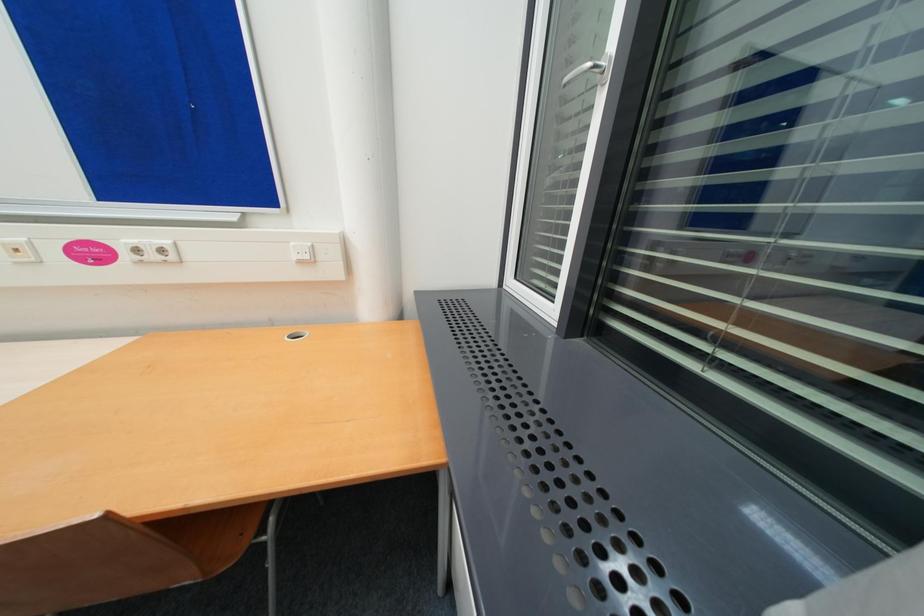
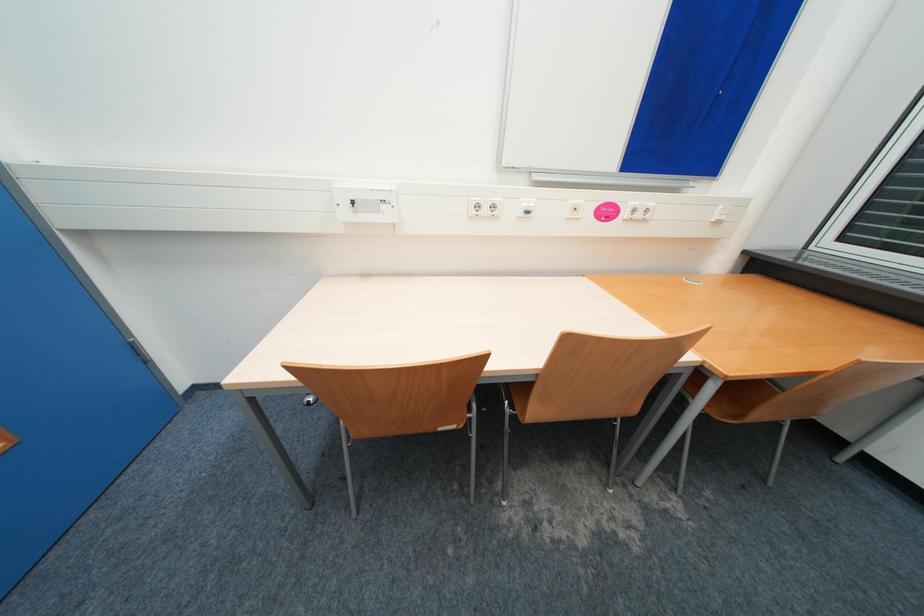
Question: The images are taken continuously from a first-person perspective. In which direction are you moving?

Choices:
 (A) Left
 (B) Right
 (C) Forward
 (D) Backward

Answer: (A)